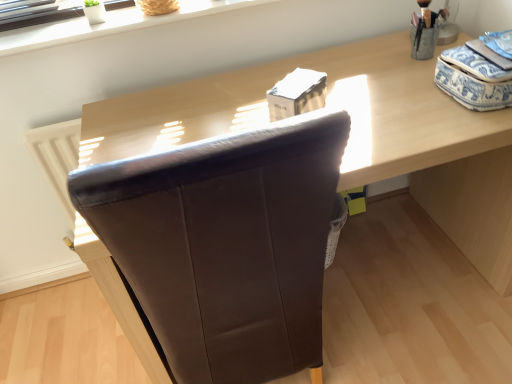
Question: Can you confirm if brown leather chair at center is bigger than white smooth window sill at upper center?

Choices:
 (A) yes
 (B) no

Answer: (A)

Question: From the image's perspective, would you say brown leather chair at center is positioned over white smooth window sill at upper center?

Choices:
 (A) yes
 (B) no

Answer: (B)

Question: Does brown leather chair at center have a greater height compared to white smooth window sill at upper center?

Choices:
 (A) yes
 (B) no

Answer: (A)

Question: Is brown leather chair at center outside of white smooth window sill at upper center?

Choices:
 (A) no
 (B) yes

Answer: (B)

Question: From a real-world perspective, is brown leather chair at center under white smooth window sill at upper center?

Choices:
 (A) yes
 (B) no

Answer: (A)

Question: Is brown leather chair at center behind white smooth window sill at upper center?

Choices:
 (A) yes
 (B) no

Answer: (B)

Question: Can you confirm if white smooth window sill at upper center is shorter than brown leather chair at center?

Choices:
 (A) yes
 (B) no

Answer: (A)

Question: Is white smooth window sill at upper center wider than brown leather chair at center?

Choices:
 (A) no
 (B) yes

Answer: (A)

Question: Is white smooth window sill at upper center taller than brown leather chair at center?

Choices:
 (A) yes
 (B) no

Answer: (B)

Question: Is white smooth window sill at upper center outside brown leather chair at center?

Choices:
 (A) no
 (B) yes

Answer: (B)

Question: Can you confirm if white smooth window sill at upper center is bigger than brown leather chair at center?

Choices:
 (A) yes
 (B) no

Answer: (B)

Question: Does white smooth window sill at upper center lie behind brown leather chair at center?

Choices:
 (A) no
 (B) yes

Answer: (B)

Question: Is brown leather chair at center positioned with its back to brown leather chair at center?

Choices:
 (A) no
 (B) yes

Answer: (B)